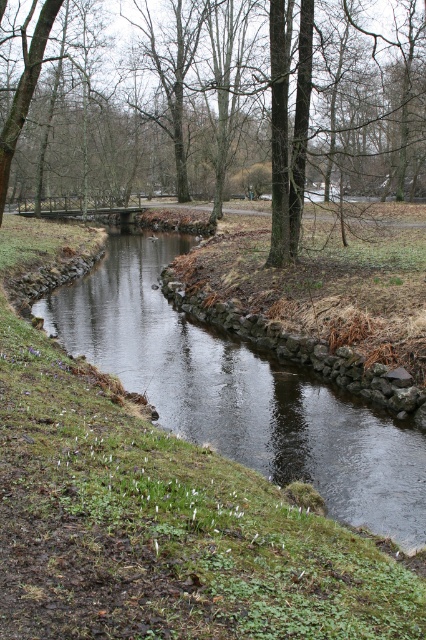
You are a hiker who wants to take a photo of the brown bark tree at center and the dark gray stone stream at center. Which object should you focus on first if you want to capture both in a single frame without moving the camera?

You should focus on the brown bark tree at center first because it is taller than the dark gray stone stream at center, allowing you to frame it properly while ensuring the stream remains in the shot.

You are a hiker trying to cross the dark gray stone stream at center. You notice a brown bark tree at center nearby. Which object would you use to steady yourself while crossing the stream?

The brown bark tree at center has a larger size compared to the dark gray stone stream at center, so you can use it to steady yourself while crossing the stream.